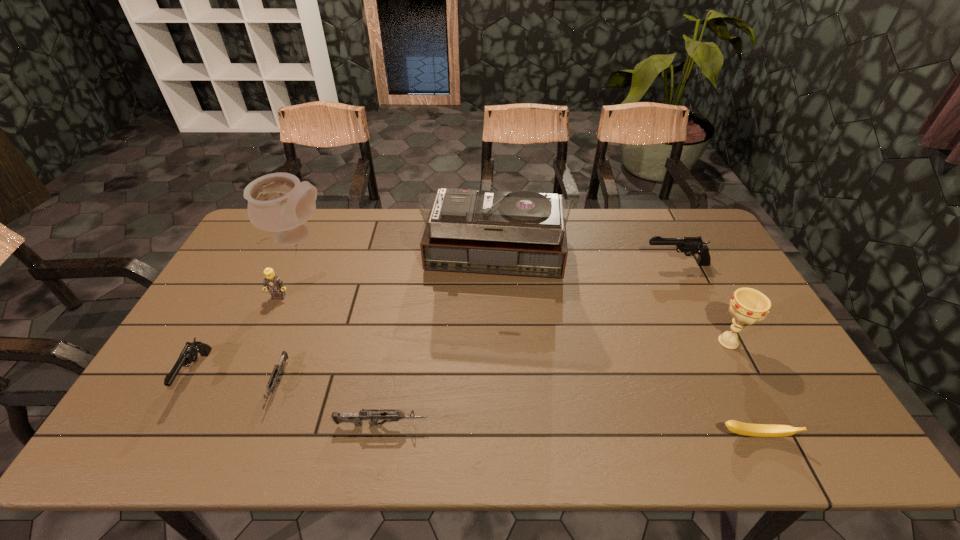
Identify the location of vacant area that lies between the third tallest object and the tan Lego. Image resolution: width=960 pixels, height=540 pixels. (504, 319).

Identify which object is the nearest to the third shortest gun. Please provide its 2D coordinates. Your answer should be formatted as a tuple, i.e. [(x, y)], where the tuple contains the x and y coordinates of a point satisfying the conditions above.

[(272, 282)]

Locate an element on the screen. The height and width of the screenshot is (540, 960). the eighth closest object to the tallest object is located at coordinates (189, 354).

The height and width of the screenshot is (540, 960). What are the coordinates of `the fourth closest gun to the tallest object` in the screenshot? It's located at (189, 354).

Select which gun is the second closest to the left grey gun. Please provide its 2D coordinates. Your answer should be formatted as a tuple, i.e. [(x, y)], where the tuple contains the x and y coordinates of a point satisfying the conditions above.

[(189, 354)]

Identify the location of free space that satisfies the following two spatial constraints: 1. at the end of the barrel of the bigger black gun; 2. aimed along the barrel of the shortest object. The image size is (960, 540). (735, 386).

At what (x,y) coordinates should I click in order to perform the action: click on free location that satisfies the following two spatial constraints: 1. at the end of the barrel of the right black gun; 2. at the end of the barrel of the leftmost gun. Please return your answer as a coordinate pair (x, y). The width and height of the screenshot is (960, 540). Looking at the image, I should click on (730, 373).

The image size is (960, 540). I want to click on free space that satisfies the following two spatial constraints: 1. at the end of the barrel of the tallest gun; 2. at the end of the barrel of the smaller black gun, so click(730, 373).